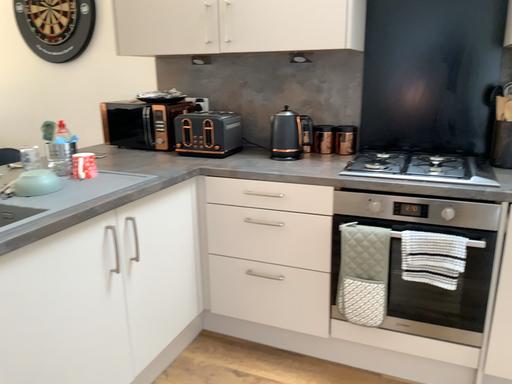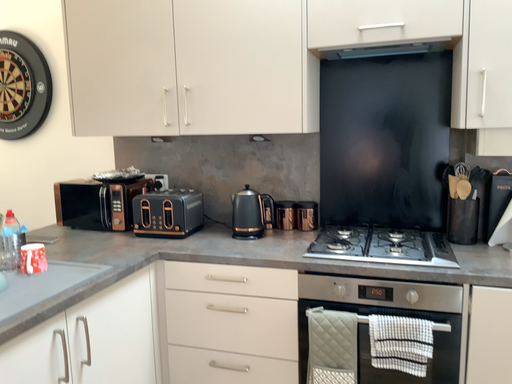
Question: How did the camera likely rotate when shooting the video?

Choices:
 (A) rotated downward
 (B) rotated upward

Answer: (B)